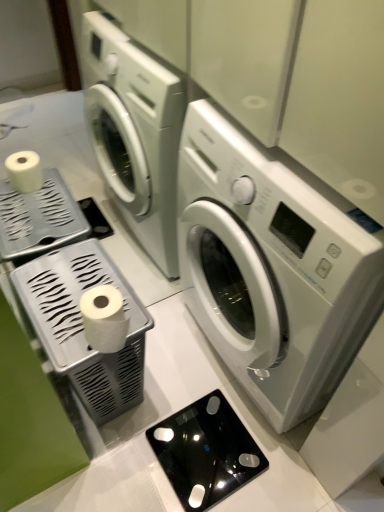
Image resolution: width=384 pixels, height=512 pixels. What are the coordinates of `free spot below black glass scale at lower center, placed as the 2th appliance when sorted from left to right (from a real-world perspective)` in the screenshot? It's located at (228, 458).